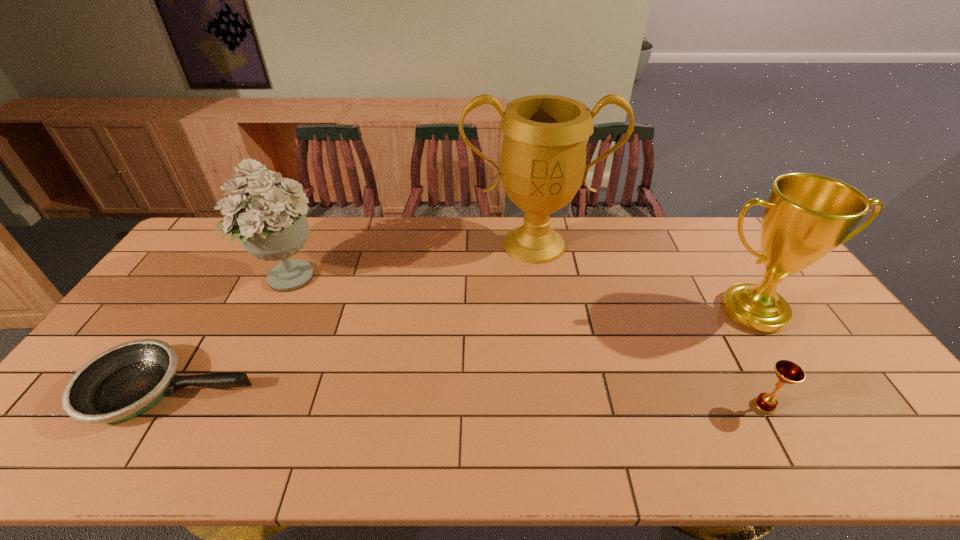
The image size is (960, 540). Find the location of `vacant region at the far right corner of the desktop`. vacant region at the far right corner of the desktop is located at coordinates (725, 247).

Where is `vacant space at the near right corner`? This screenshot has height=540, width=960. vacant space at the near right corner is located at coordinates [x=943, y=463].

At what (x,y) coordinates should I click in order to perform the action: click on free space between the award and the bouquet. Please return your answer as a coordinate pair (x, y). The width and height of the screenshot is (960, 540). Looking at the image, I should click on (520, 294).

Where is `blank region between the bouquet and the third object from right to left`? The image size is (960, 540). blank region between the bouquet and the third object from right to left is located at coordinates (411, 261).

Where is `vacant space that is in between the chalice and the shortest object`? The height and width of the screenshot is (540, 960). vacant space that is in between the chalice and the shortest object is located at coordinates (468, 397).

At what (x,y) coordinates should I click in order to perform the action: click on vacant space that is in between the second shortest object and the tallest object. Please return your answer as a coordinate pair (x, y). Looking at the image, I should click on (649, 325).

The height and width of the screenshot is (540, 960). Identify the location of free space between the frying pan and the tallest object. (352, 317).

Locate an element on the screen. The image size is (960, 540). free space that is in between the third object from right to left and the second shortest object is located at coordinates (649, 325).

The width and height of the screenshot is (960, 540). In order to click on vacant region between the third object from left to right and the chalice in this screenshot , I will do `click(649, 325)`.

This screenshot has width=960, height=540. In order to click on unoccupied area between the frying pan and the second shortest object in this screenshot , I will do `click(468, 397)`.